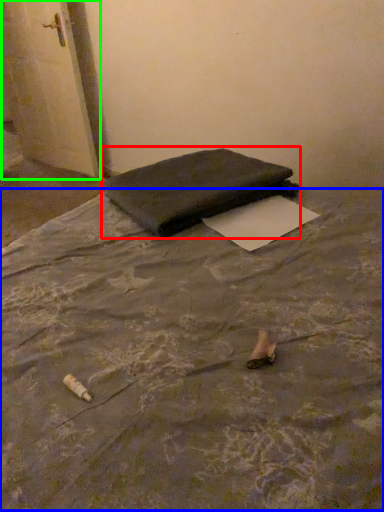
Question: Which object is the farthest from furniture (highlighted by a red box)? Choose among these: mattress (highlighted by a blue box) or door (highlighted by a green box).

Choices:
 (A) mattress
 (B) door

Answer: (B)